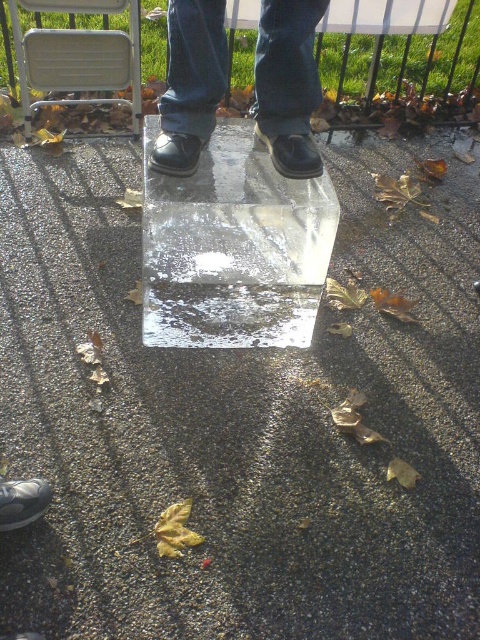
Does matte black shoes at center appear on the left side of metallic silver folding chair at upper left?

In fact, matte black shoes at center is to the right of metallic silver folding chair at upper left.

Who is higher up, matte black shoes at center or metallic silver folding chair at upper left?

Positioned higher is metallic silver folding chair at upper left.

Identify the location of matte black shoes at center. (288, 83).